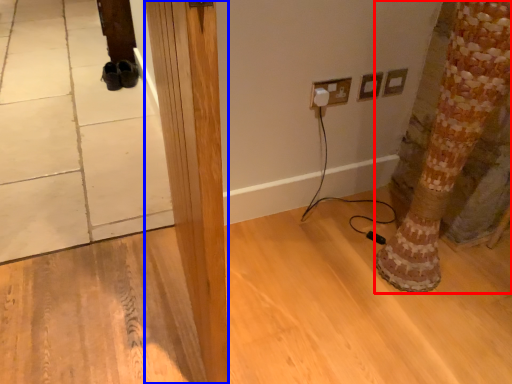
Question: Which point is further to the camera, tree trunk (highlighted by a red box) or pillar (highlighted by a blue box)?

Choices:
 (A) tree trunk
 (B) pillar

Answer: (A)